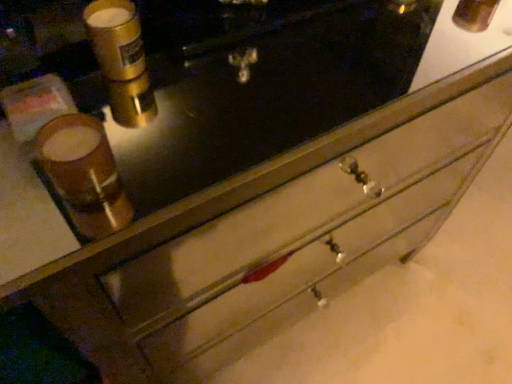
Question: From the image's perspective, is gold metallic canister at upper left, placed as the second beverage when sorted from front to back, on matte brown cup at left, which is counted as the 1th beverage, starting from the front?

Choices:
 (A) no
 (B) yes

Answer: (B)

Question: Can you confirm if gold metallic canister at upper left, acting as the first beverage starting from the back, is wider than matte brown cup at left, positioned as the first beverage in bottom-to-top order?

Choices:
 (A) yes
 (B) no

Answer: (B)

Question: From a real-world perspective, is gold metallic canister at upper left, acting as the first beverage starting from the back, over matte brown cup at left, the second beverage in the back-to-front sequence?

Choices:
 (A) no
 (B) yes

Answer: (A)

Question: Would you say gold metallic canister at upper left, positioned as the 2th beverage in bottom-to-top order, contains matte brown cup at left, which is counted as the 1th beverage, starting from the front?

Choices:
 (A) yes
 (B) no

Answer: (B)

Question: Is gold metallic canister at upper left, positioned as the 2th beverage in bottom-to-top order, turned away from matte brown cup at left, the second beverage when ordered from top to bottom?

Choices:
 (A) yes
 (B) no

Answer: (B)

Question: Are gold metallic canister at upper left, acting as the first beverage starting from the back, and matte brown cup at left, which is counted as the 1th beverage, starting from the front, located far from each other?

Choices:
 (A) yes
 (B) no

Answer: (B)

Question: Does matte brown cup at left, positioned as the first beverage in bottom-to-top order, have a greater width compared to gold metallic canister at upper left, acting as the first beverage starting from the back?

Choices:
 (A) yes
 (B) no

Answer: (A)

Question: Does matte brown cup at left, the second beverage when ordered from top to bottom, touch gold metallic canister at upper left, positioned as the 2th beverage in bottom-to-top order?

Choices:
 (A) no
 (B) yes

Answer: (A)

Question: Is matte brown cup at left, positioned as the first beverage in bottom-to-top order, not within gold metallic canister at upper left, acting as the first beverage starting from the back?

Choices:
 (A) yes
 (B) no

Answer: (A)

Question: Can you confirm if matte brown cup at left, positioned as the first beverage in bottom-to-top order, is taller than gold metallic canister at upper left, positioned as the 2th beverage in bottom-to-top order?

Choices:
 (A) no
 (B) yes

Answer: (A)

Question: Is the position of matte brown cup at left, the second beverage in the back-to-front sequence, less distant than that of gold metallic canister at upper left, positioned as the 2th beverage in bottom-to-top order?

Choices:
 (A) yes
 (B) no

Answer: (A)

Question: Could you tell me if matte brown cup at left, positioned as the first beverage in bottom-to-top order, is facing gold metallic canister at upper left, positioned as the 2th beverage in bottom-to-top order?

Choices:
 (A) no
 (B) yes

Answer: (A)

Question: Relative to matte brown cup at left, which is counted as the 1th beverage, starting from the front, is gold metallic canister at upper left, placed as the second beverage when sorted from front to back, in front or behind?

Choices:
 (A) behind
 (B) front

Answer: (A)